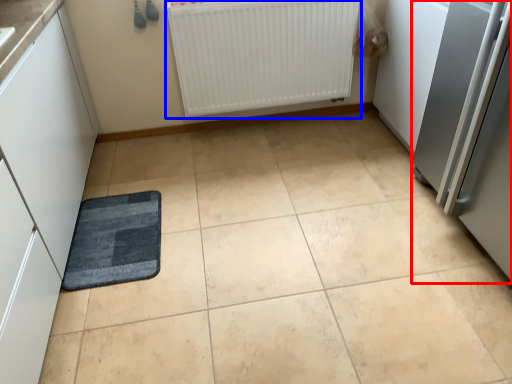
Question: Which object is closer to the camera taking this photo, appliance (highlighted by a red box) or radiator (highlighted by a blue box)?

Choices:
 (A) appliance
 (B) radiator

Answer: (A)